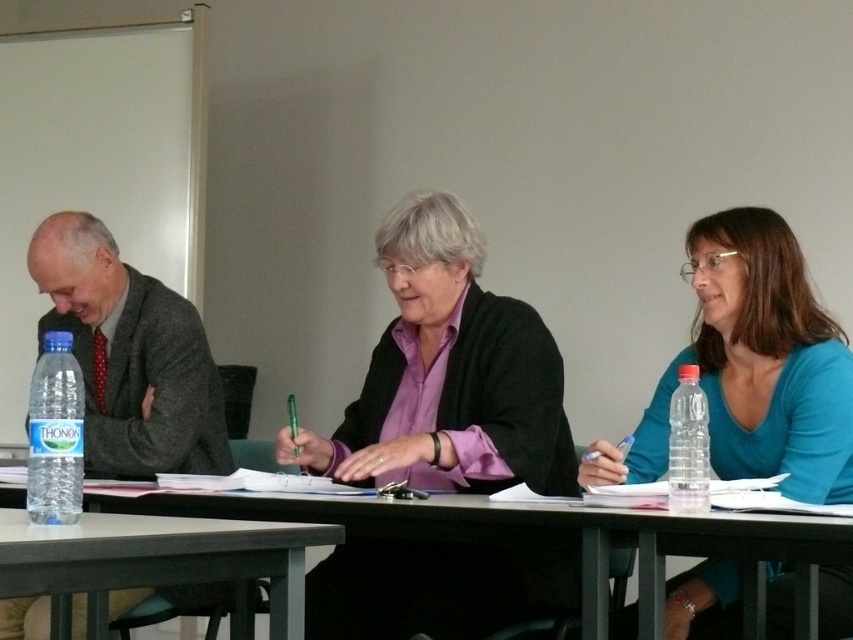
Question: Is gray woolen suit at left smaller than clear plastic bottle at left?

Choices:
 (A) no
 (B) yes

Answer: (A)

Question: Does purple matte shirt at center come in front of gray woolen suit at left?

Choices:
 (A) yes
 (B) no

Answer: (A)

Question: Which object is positioned farthest from the clear plastic bottle at left?

Choices:
 (A) purple matte shirt at center
 (B) clear plastic bottle at right
 (C) blue matte shirt at center

Answer: (C)

Question: Considering the real-world distances, which object is closest to the purple matte shirt at center?

Choices:
 (A) clear plastic bottle at left
 (B) blue matte shirt at center
 (C) gray woolen suit at left
 (D) clear plastic bottle at right

Answer: (B)

Question: Estimate the real-world distances between objects in this image. Which object is closer to the gray matte table at center?

Choices:
 (A) clear plastic bottle at left
 (B) clear plastic bottle at right

Answer: (A)

Question: Does purple matte shirt at center have a smaller size compared to gray woolen suit at left?

Choices:
 (A) yes
 (B) no

Answer: (B)